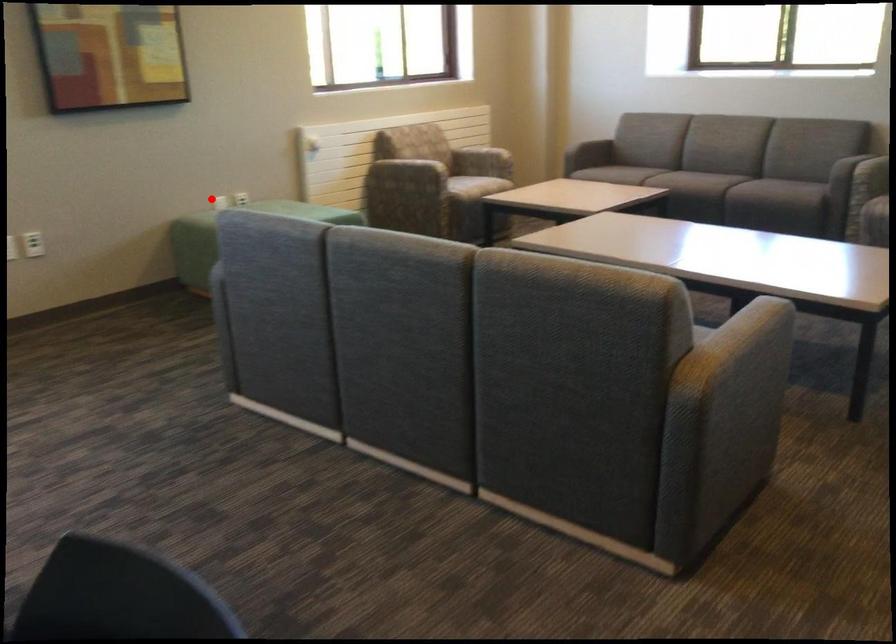
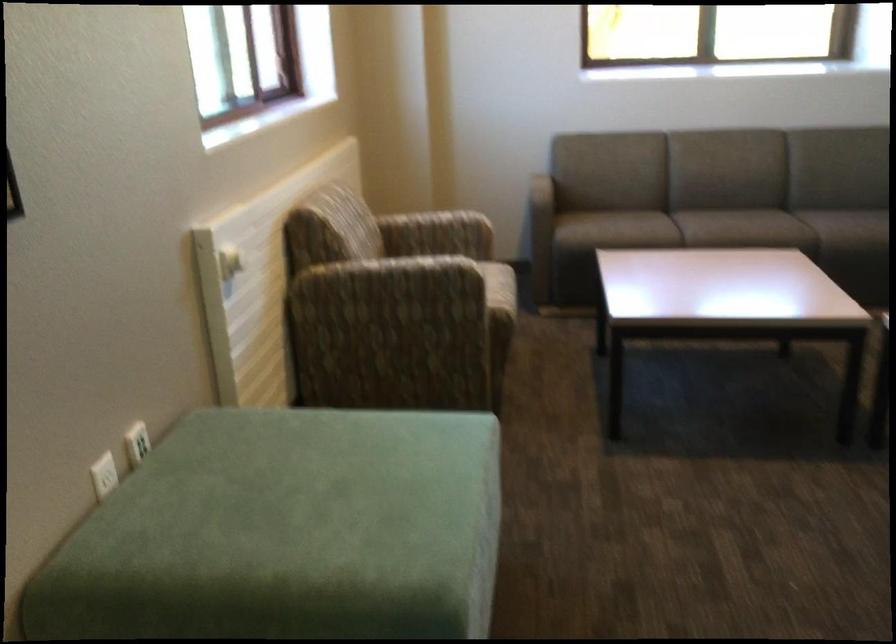
Question: A red point is marked in image1. In image2, is the corresponding 3D point closer to the camera or farther? Reply with the corresponding letter.

Choices:
 (A) The corresponding 3D point is closer.
 (B) The corresponding 3D point is farther.

Answer: (A)